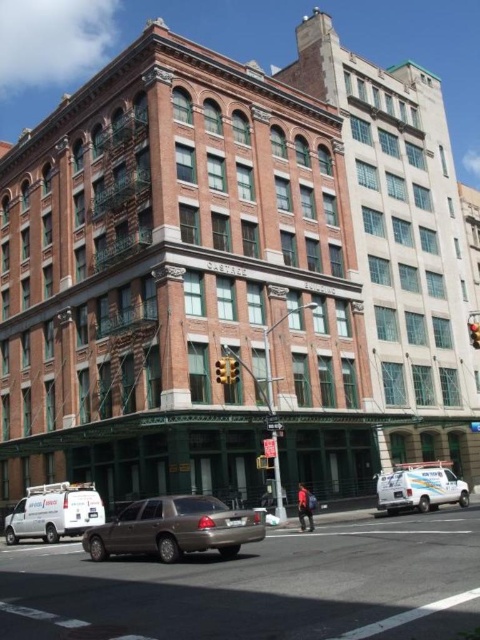
You are a delivery driver who needs to park your white matte van at lower right near the metallic rectangular traffic light at center. Considering their sizes, will the van fit in the space between the two buildings without overlapping the traffic light?

The white matte van at lower right is larger than the metallic rectangular traffic light at center. However, the scene description mentions the space between the two buildings but does not provide specific measurements of the available space. Therefore, it is uncertain if the van will fit without overlapping the traffic light.

You are standing in the middle of the urban street scene. There is a point marked at coordinates point (121, 513). Can you reach this point without moving more than 50 meters from your current position?

The point (121, 513) is 54.48 meters away from the viewer, which exceeds the 50 meters limit. Therefore, you cannot reach it without moving more than 50 meters.

You are a delivery driver who needs to park your gold metallic sedan at lower center in a parking spot located at coordinate point 0.916, 0.542. Can you confirm if your vehicle is already positioned correctly?

The gold metallic sedan at lower center is already positioned at the required coordinate point [260,586], so it is correctly parked.